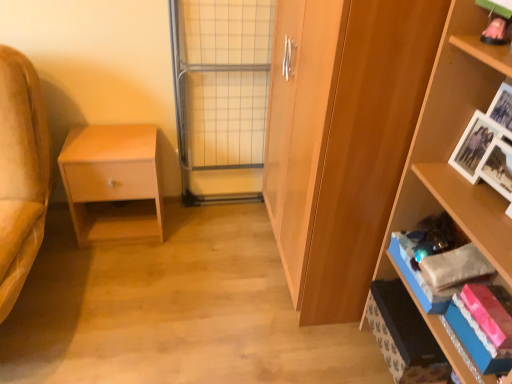
This screenshot has width=512, height=384. What are the coordinates of `free space in front of metal grid screen door at center` in the screenshot? It's located at (220, 233).